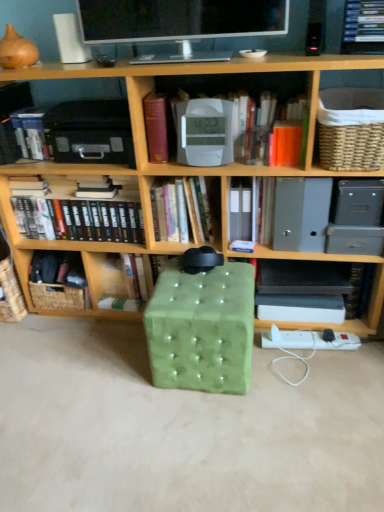
Question: Which is correct: woven brown basket at lower left, positioned as the 1th basket in back-to-front order, is inside hardcover book at left, which is the 1th book in left-to-right order, or outside of it?

Choices:
 (A) inside
 (B) outside

Answer: (B)

Question: Would you say woven brown basket at lower left, which ranks as the second basket in top-to-bottom order, is to the left or to the right of hardcover book at left, arranged as the 6th book when viewed from the right, in the picture?

Choices:
 (A) left
 (B) right

Answer: (B)

Question: Which object is the closest to the hardcover book at center, acting as the third book starting from the right?

Choices:
 (A) orange matte paper at upper right, arranged as the third paperback book when viewed from the left
 (B) woven beige basket at upper right, which is counted as the first basket, starting from the right
 (C) black hardcover book at lower right, arranged as the 1th book when viewed from the right
 (D) hardcover book at center, which is the 4th book from right to left
 (E) white plastic clock at center, the 2th book positioned from the right

Answer: (D)

Question: Considering the real-world distances, which object is farthest from the maroon leather book at upper center, marked as the third paperback book in a right-to-left arrangement?

Choices:
 (A) matte black monitor at upper center
 (B) hardcover book at center, which ranks as the 3th book in left-to-right order
 (C) white paper at center, marked as the second paperback book in a right-to-left arrangement
 (D) hardcover book at center, acting as the third book starting from the right
 (E) hardcover books at center, positioned as the fifth book in right-to-left order

Answer: (B)